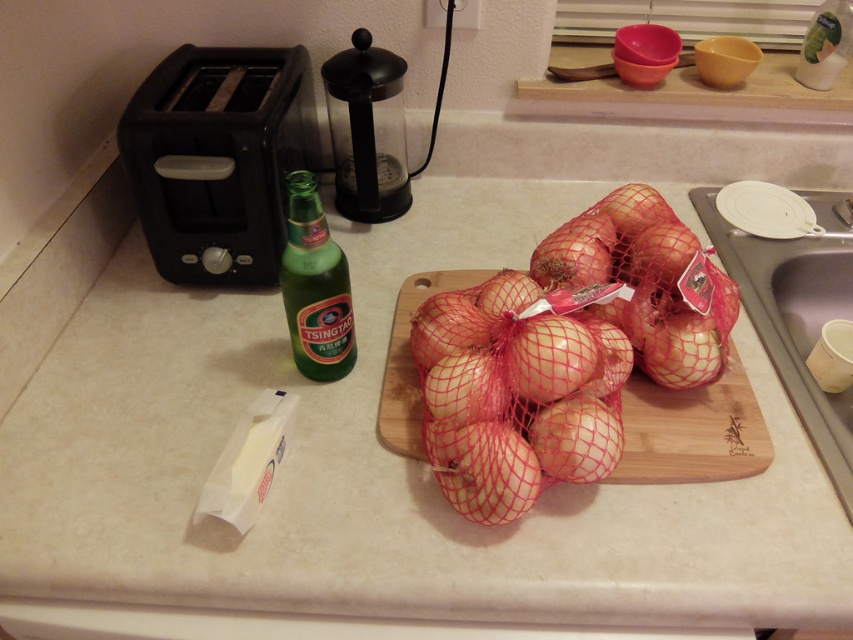
Is green glass bottle at center to the left of clear plastic bottle at upper right from the viewer's perspective?

Indeed, green glass bottle at center is positioned on the left side of clear plastic bottle at upper right.

Between point (350, 326) and point (827, 67), which one is positioned in front?

Point (350, 326) is in front.

Where is `green glass bottle at center`? green glass bottle at center is located at coordinates (315, 285).

Is point (306, 230) positioned after point (469, 508)?

Yes, point (306, 230) is farther from viewer.

Is green glass bottle at center below white mesh onion at center?

Incorrect, green glass bottle at center is not positioned below white mesh onion at center.

This screenshot has width=853, height=640. I want to click on green glass bottle at center, so click(315, 285).

Is wooden cutting board at center positioned before clear plastic bottle at upper right?

Yes, wooden cutting board at center is closer to the viewer.

Can you confirm if wooden cutting board at center is positioned to the right of clear plastic bottle at upper right?

Incorrect, wooden cutting board at center is not on the right side of clear plastic bottle at upper right.

Does point (669, 481) come in front of point (817, 84)?

Yes, it is in front of point (817, 84).

This screenshot has height=640, width=853. Identify the location of wooden cutting board at center. (692, 429).